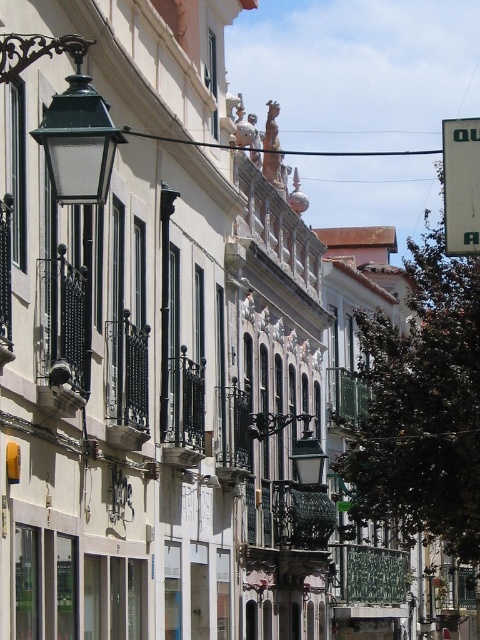
Does green matte streetlamp at upper left appear under white plastic sign at upper right?

Indeed, green matte streetlamp at upper left is positioned under white plastic sign at upper right.

Does green matte streetlamp at upper left have a smaller size compared to white plastic sign at upper right?

Yes, green matte streetlamp at upper left is smaller than white plastic sign at upper right.

Is point (57, 147) positioned before point (447, 195)?

That is True.

I want to click on green matte streetlamp at upper left, so click(x=68, y=120).